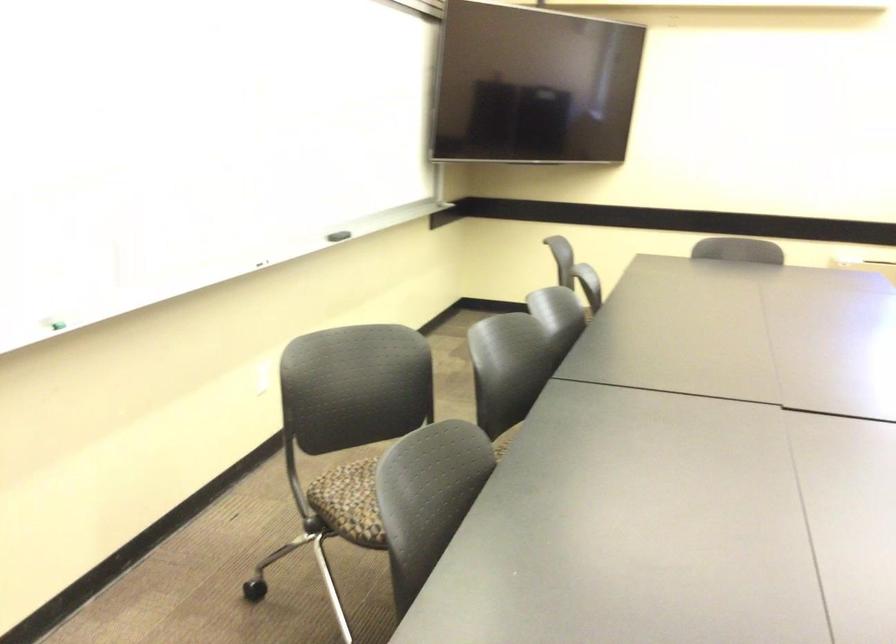
Where is `patterned chair sitting surface`? The height and width of the screenshot is (644, 896). patterned chair sitting surface is located at coordinates (350, 502).